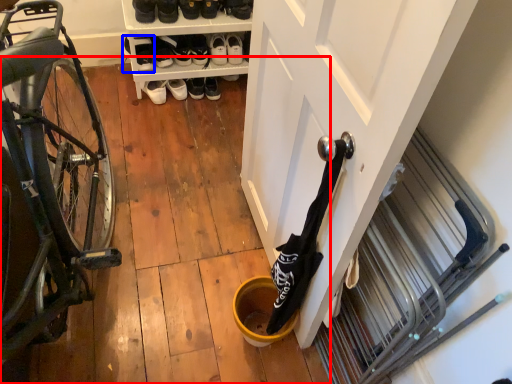
Question: Among these objects, which one is farthest to the camera, wood (highlighted by a red box) or footwear (highlighted by a blue box)?

Choices:
 (A) wood
 (B) footwear

Answer: (B)